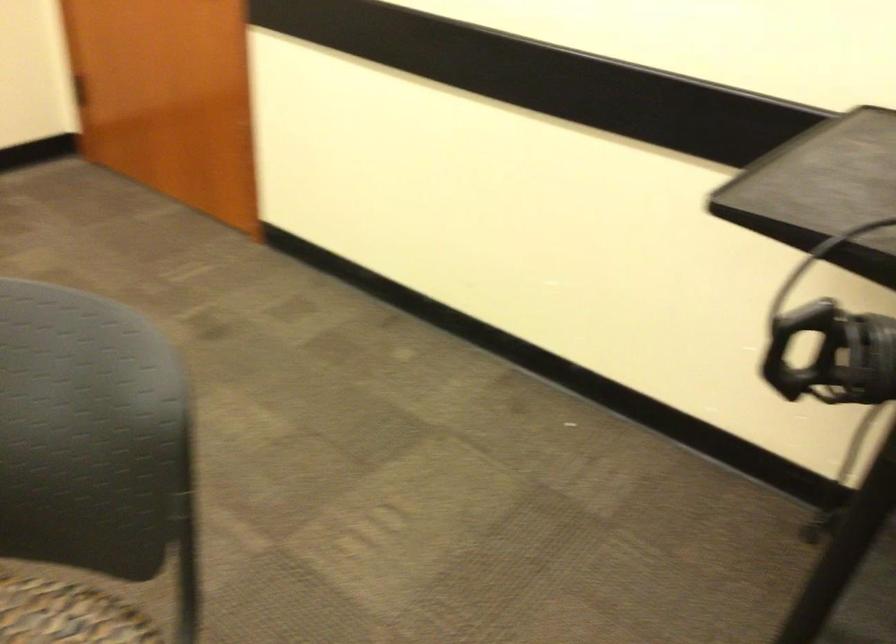
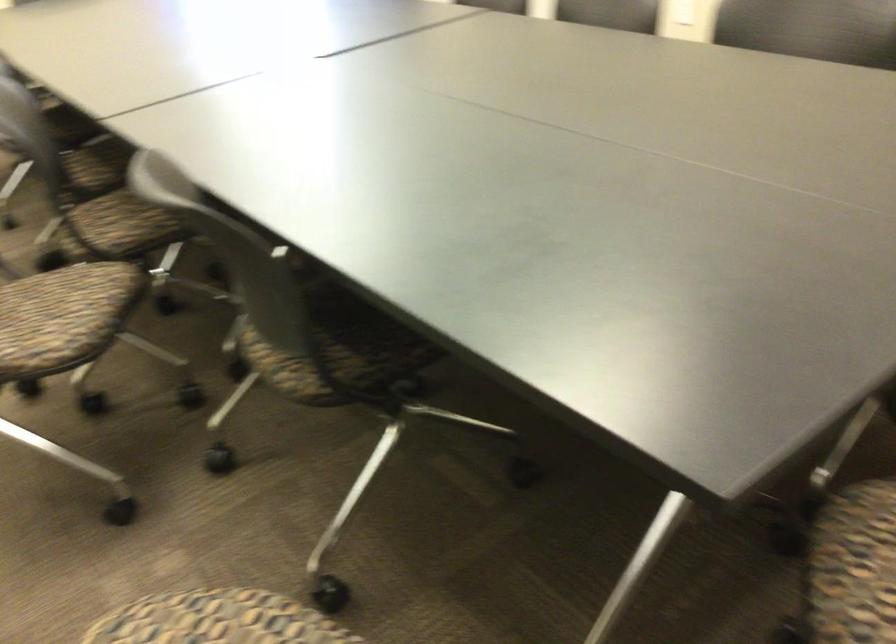
In the scene shown: Based on the continuous images, in which direction is the camera rotating?

The camera rotated toward left-down.